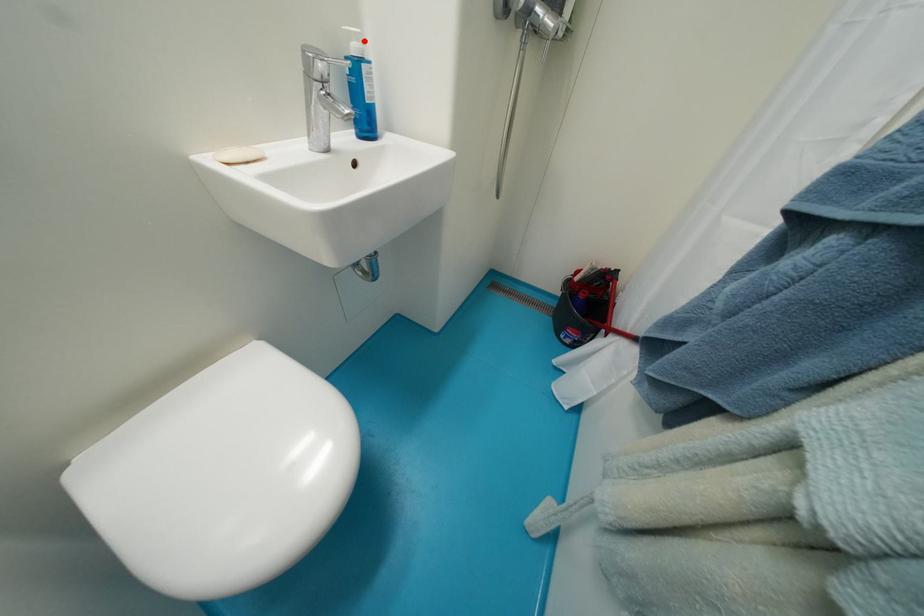
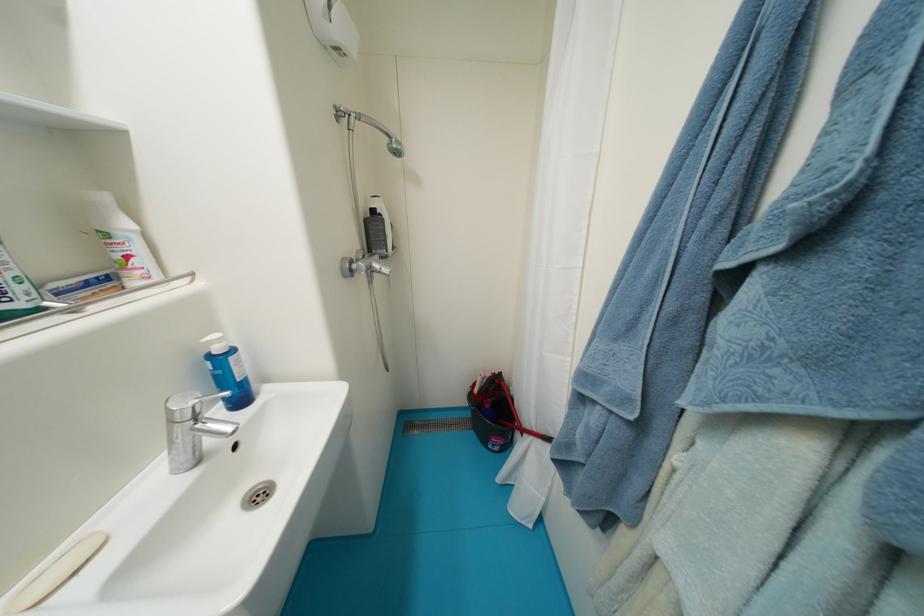
Find the pixel in the second image that matches the highlighted location in the first image.

(225, 342)